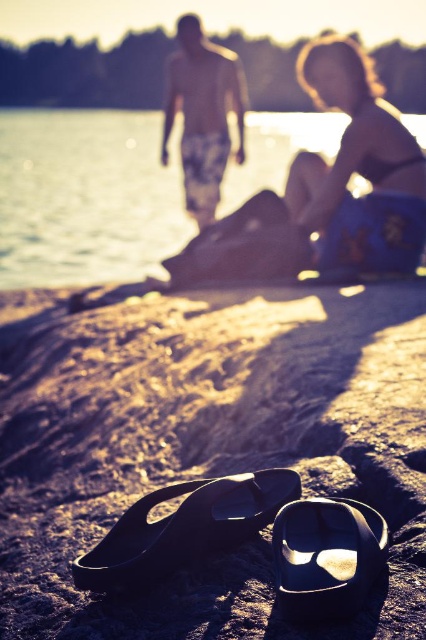
Question: Which point appears farthest from the camera in this image?

Choices:
 (A) (172, 100)
 (B) (331, 589)
 (C) (103, 145)

Answer: (C)

Question: Can you confirm if blue fabric bikini top at upper right is bigger than matte floral shorts at upper center?

Choices:
 (A) yes
 (B) no

Answer: (B)

Question: From the image, what is the correct spatial relationship of clear water at center in relation to blue fabric bikini top at upper right?

Choices:
 (A) left
 (B) right

Answer: (A)

Question: Can you confirm if blue fabric bikini top at upper right is positioned above black rubber flip-flop at lower center?

Choices:
 (A) yes
 (B) no

Answer: (A)

Question: Which point is closer to the camera taking this photo?

Choices:
 (A) (357, 314)
 (B) (334, 502)
 (C) (28, 268)

Answer: (B)

Question: Based on their relative distances, which object is nearer to the clear water at center?

Choices:
 (A) black rubber flip-flop at lower center
 (B) blue fabric bikini top at upper right
 (C) black matte sand at lower center

Answer: (C)